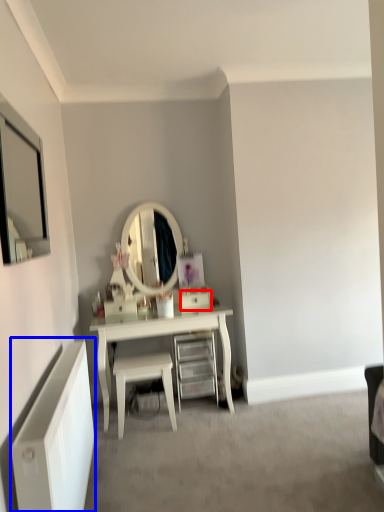
Question: Which of the following is the farthest to the observer, drawer (highlighted by a red box) or radiator (highlighted by a blue box)?

Choices:
 (A) drawer
 (B) radiator

Answer: (A)